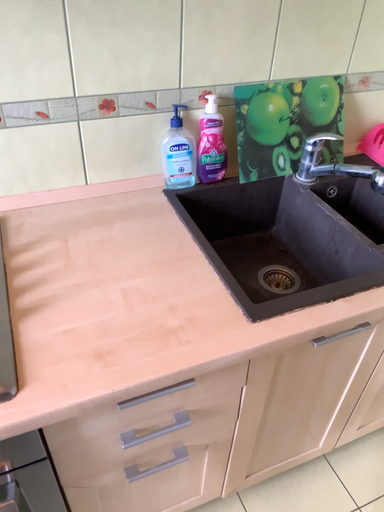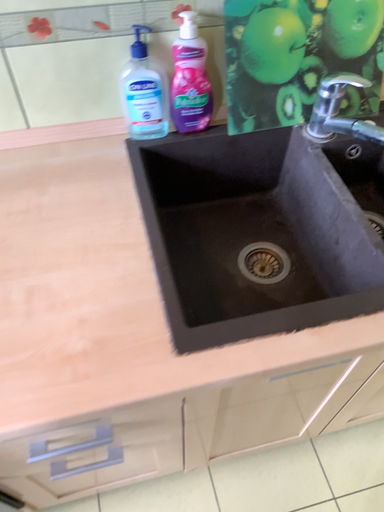
Question: How did the camera likely rotate when shooting the video?

Choices:
 (A) rotated left
 (B) rotated right

Answer: (A)